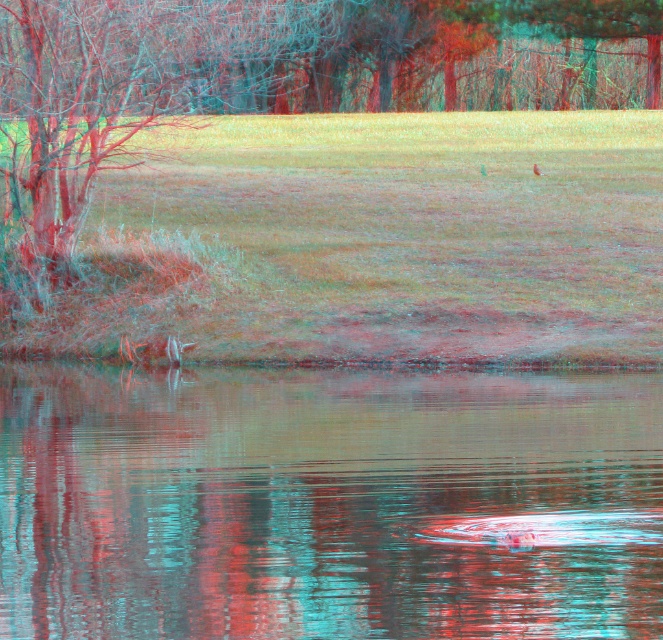
You are standing at the edge of the water in the serene natural scene. You notice two points marked in the image. The first point is at coordinate point(x=263, y=420) and the second is at point(x=540, y=172). Which point is closer to you?

Point(x=263, y=420) is in front of point(x=540, y=172), so the first point is closer to you.

You are standing on the edge of the water and see the green grass at center and the brown fuzzy bird at center. Which object is positioned to the left of the other?

The green grass at center is to the left of the brown fuzzy bird at center.

You are standing at the edge of the clear water at center and want to observe the brown fuzzy bird at center. Which direction should you look to see the bird?

The clear water at center is positioned under the brown fuzzy bird at center, so you should look upward to see the brown fuzzy bird at center.